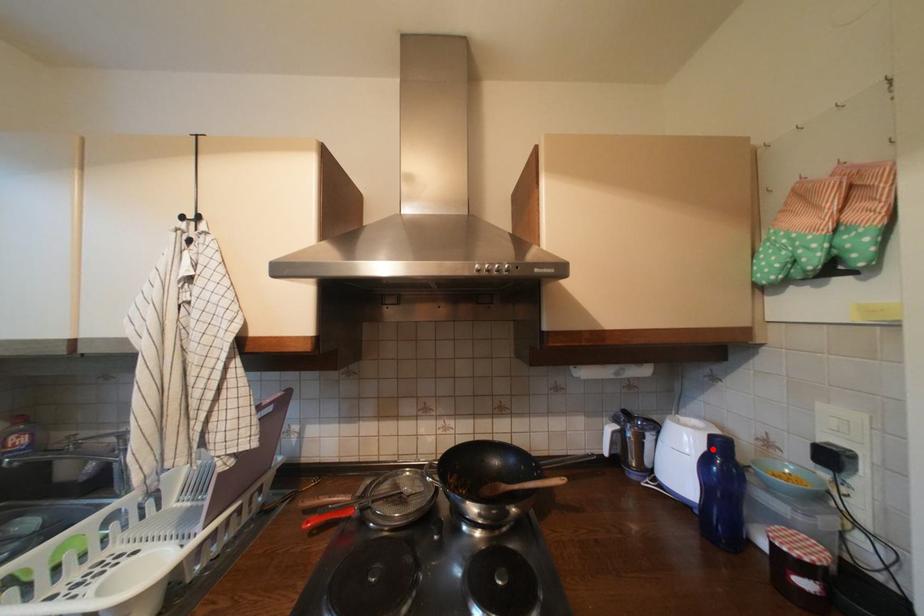
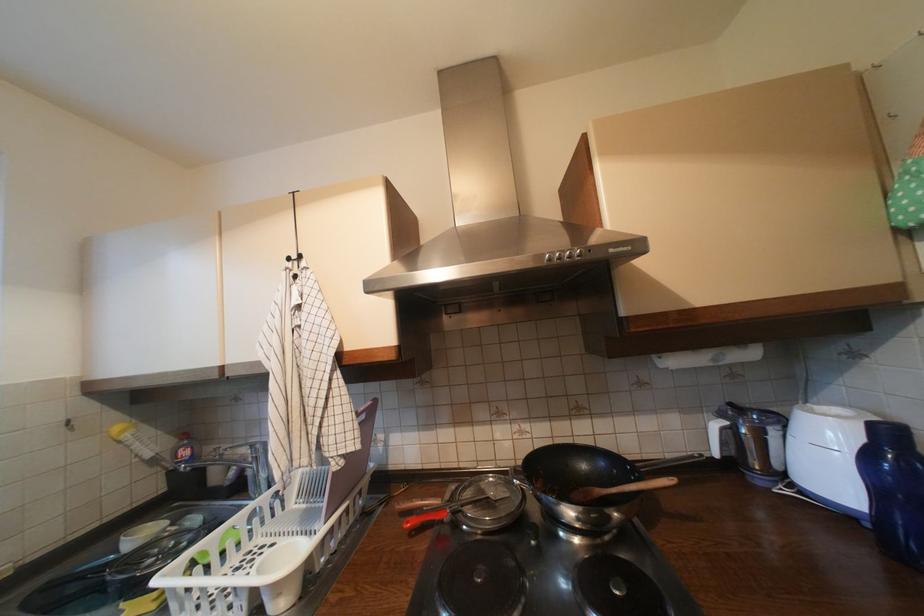
Find the pixel in the second image that matches the highlighted location in the first image.

(870, 440)